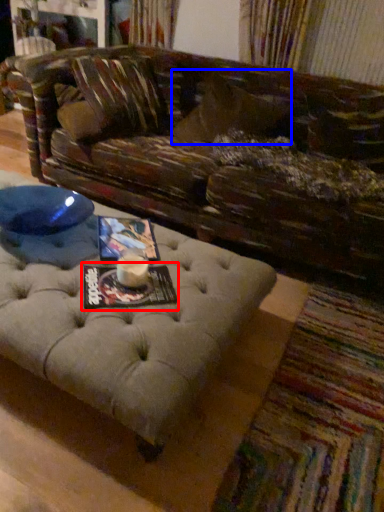
Question: Which object is further to the camera taking this photo, magazine (highlighted by a red box) or pillow (highlighted by a blue box)?

Choices:
 (A) magazine
 (B) pillow

Answer: (B)